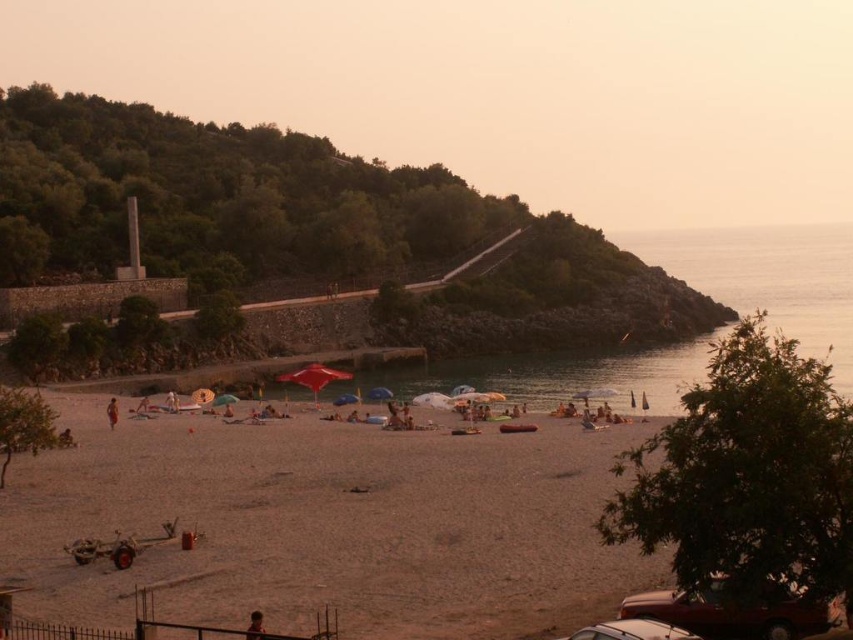
Is light brown sand at center thinner than smooth skin person at lower center?

No.

Which is more to the right, light brown sand at center or smooth skin person at lower center?

smooth skin person at lower center is more to the right.

The width and height of the screenshot is (853, 640). I want to click on light brown sand at center, so click(x=328, y=525).

Does clear water at right appear under blue fabric umbrella at center?

Incorrect, clear water at right is not positioned below blue fabric umbrella at center.

Is point (811, 236) farther from viewer compared to point (381, 387)?

That is True.

Locate an element on the screen. clear water at right is located at coordinates (769, 278).

Can you confirm if green leafy hillside at upper left is positioned above brown fabric person at lower left?

Indeed, green leafy hillside at upper left is positioned over brown fabric person at lower left.

Who is positioned more to the right, green leafy hillside at upper left or brown fabric person at lower left?

brown fabric person at lower left

Does point (637, 292) come farther from viewer compared to point (107, 412)?

Yes, it is.

At what (x,y) coordinates should I click in order to perform the action: click on green leafy hillside at upper left. Please return your answer as a coordinate pair (x, y). The height and width of the screenshot is (640, 853). Looking at the image, I should click on (306, 227).